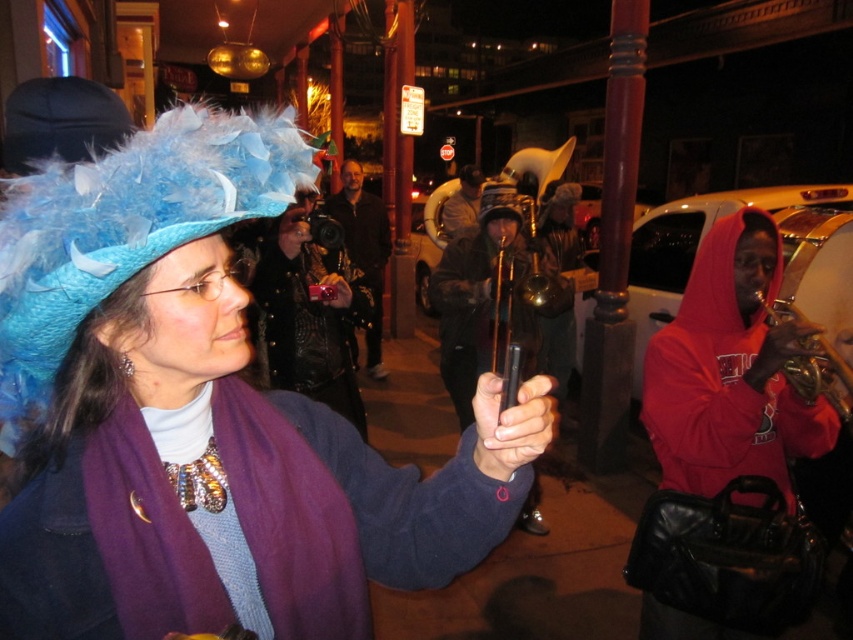
Question: Which object is positioned closest to the metallic silver phone at center?

Choices:
 (A) matte blue feathered hat at center
 (B) blue feathered hat at upper left
 (C) shiny black camera at center
 (D) red hoodie at right

Answer: (C)

Question: Among these points, which one is farthest from the camera?

Choices:
 (A) (318, 268)
 (B) (488, 464)

Answer: (A)

Question: Is red hoodie at right above feathered blue hat at center?

Choices:
 (A) yes
 (B) no

Answer: (B)

Question: Does black matte pen at center have a lesser width compared to feathered blue hat at center?

Choices:
 (A) yes
 (B) no

Answer: (A)

Question: Estimate the real-world distances between objects in this image. Which object is closer to the red hoodie at right?

Choices:
 (A) blue feathered hat at upper left
 (B) matte blue feathered hat at center
 (C) feathered blue hat at center

Answer: (B)

Question: Can you confirm if matte blue feathered hat at center is positioned to the right of red hoodie at right?

Choices:
 (A) yes
 (B) no

Answer: (B)